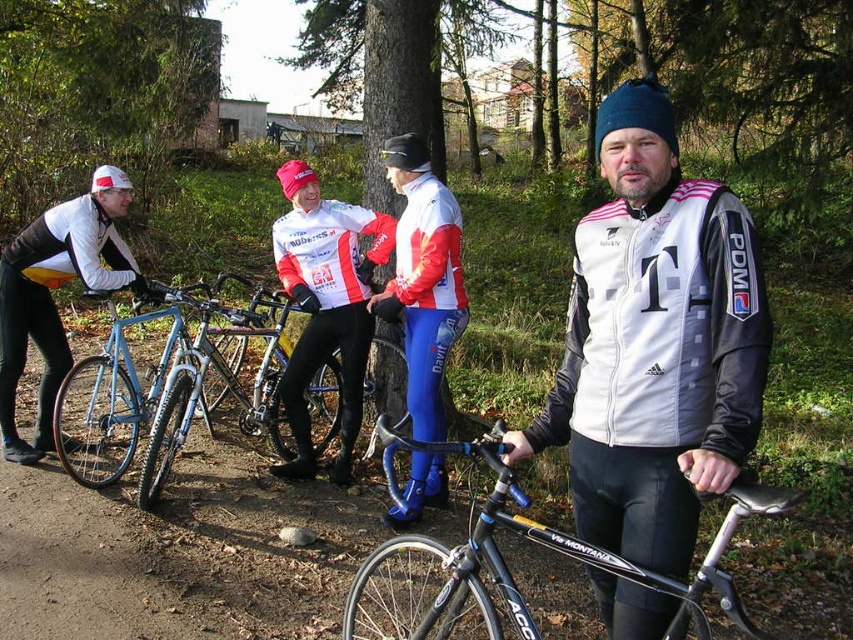
You are a cyclist who wants to park your bike near the blue metallic bicycle at left and the shiny blue frame at center. Can you fit your 12 inch wide bike between them without touching either?

The blue metallic bicycle at left and the shiny blue frame at center are 11.80 inches apart. Since your bike is 12 inches wide, it won t fit between them without touching either.

Based on the photo, you are a photographer trying to capture the cyclists in the scene. You notice two points marked in the image. Which point, point (207, 305) or point (281, 337), is closer to your camera lens?

Point (207, 305) is closer to the camera lens than point (281, 337).